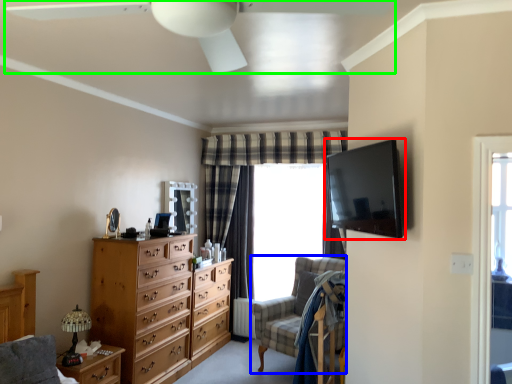
Question: Estimate the real-world distances between objects in this image. Which object is closer to television (highlighted by a red box), swivel chair (highlighted by a blue box) or ceiling fan (highlighted by a green box)?

Choices:
 (A) swivel chair
 (B) ceiling fan

Answer: (B)